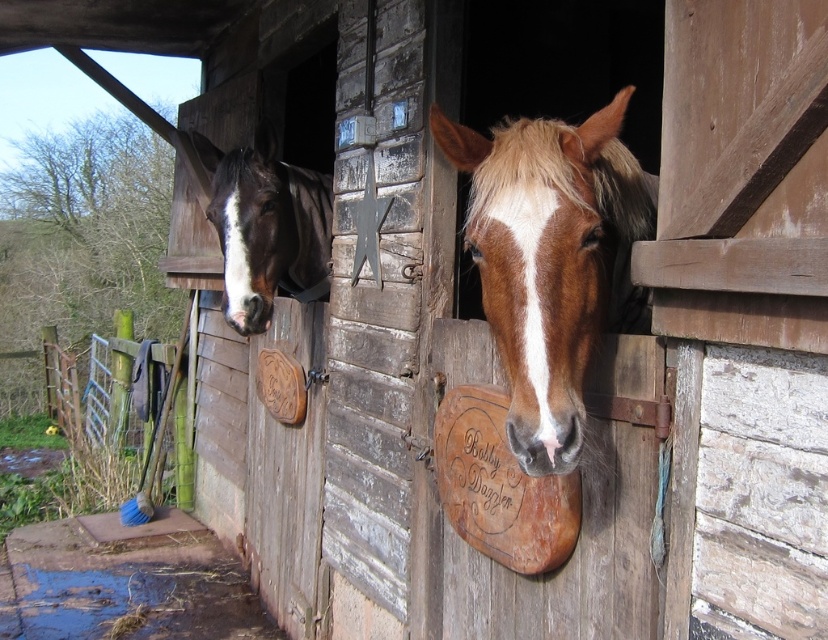
Based on the photo, you are standing at the point marked by the coordinate point at point (x=504, y=336). You want to walk to the stable door of the horse named Robby Dazzler. Can you reach it without crossing the 5.06 feet distance?

The distance between you and the stable door of the horse named Robby Dazzler is 5.06 feet, so yes, you can reach it without crossing that distance since you are already at the required distance.

You are a farmer who needs to place a 1.2 meter wide hay bale between the brown glossy horse at center and the brown glossy horse at left. Will the hay bale fit in the space between them?

The distance between the brown glossy horse at center and the brown glossy horse at left is 1.52 meters, so the 1.2 meter wide hay bale will fit in the space between them since it is narrower than the available space.